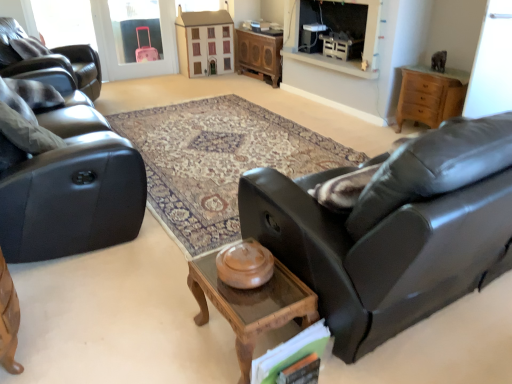
This screenshot has height=384, width=512. What are the coordinates of `vacant space in front of pink plastic suitcase at upper left` in the screenshot? It's located at (143, 80).